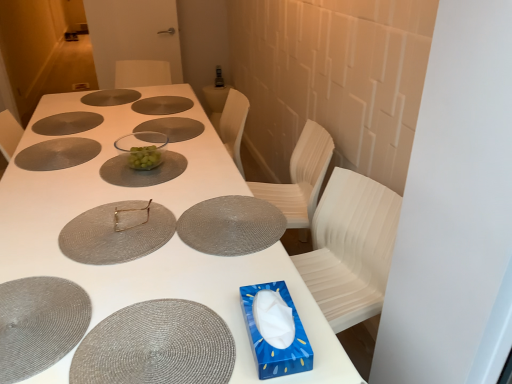
This screenshot has width=512, height=384. I want to click on vacant region under transparent glass bowl at center, the fourth glass plate viewed from the back (from a real-world perspective), so click(x=164, y=124).